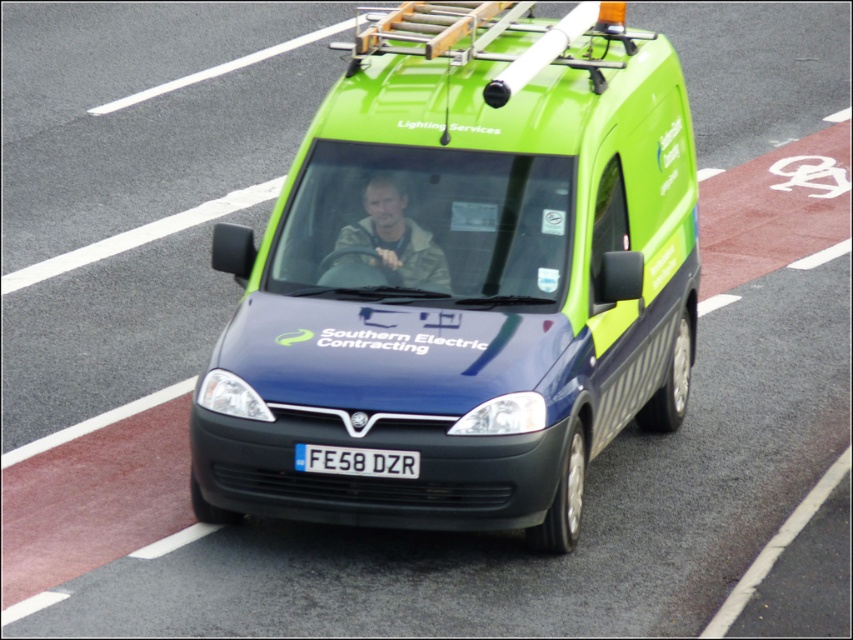
You are a traffic officer observing a van on the road. You need to determine the color of the van based on its position at point (461,282). What color is the van at this point?

The van at point (461,282) is green matte.

You are a photographer trying to capture the green matte van at center for a commercial shoot. You want to ensure the black plastic license plate at center is visible in the shot. Given their relative sizes, will the license plate be easily noticeable in the photo?

The green matte van at center has a greater height compared to the black plastic license plate at center, so the license plate may be smaller and less noticeable in the photo compared to the van.